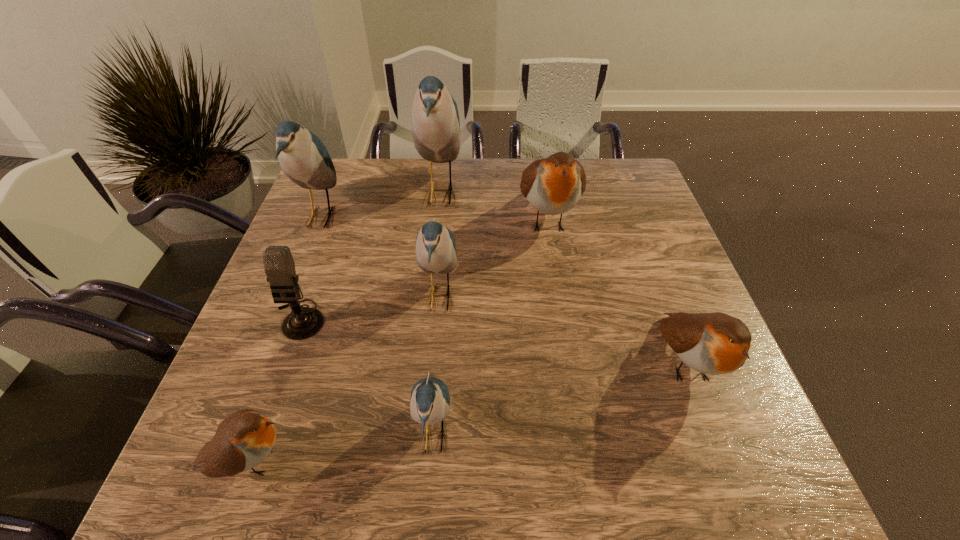
The image size is (960, 540). Identify the location of the nearest blue bird. (430, 401).

Locate an element on the screen. the shortest bird is located at coordinates tap(244, 439).

Identify the location of the shortest object. The width and height of the screenshot is (960, 540). (244, 439).

This screenshot has height=540, width=960. Find the location of `vacant space located at the tip of the tallest object's beak`. vacant space located at the tip of the tallest object's beak is located at coordinates (582, 193).

Where is `vacant space located 0.330m at the tip of the leftmost blue bird's beak`? The height and width of the screenshot is (540, 960). vacant space located 0.330m at the tip of the leftmost blue bird's beak is located at coordinates (456, 217).

Find the location of a particular element. vacant region located at the face of the second bird from right to left is located at coordinates (561, 299).

Identify the location of vacant space located 0.140m at the tip of the third farthest blue bird's beak. (517, 298).

Where is `free region located 0.170m on the front-facing side of the microphone`? The height and width of the screenshot is (540, 960). free region located 0.170m on the front-facing side of the microphone is located at coordinates (265, 414).

Where is `vacant space located 0.070m at the face of the rightmost brown bird`? Image resolution: width=960 pixels, height=540 pixels. vacant space located 0.070m at the face of the rightmost brown bird is located at coordinates (721, 454).

You are a GUI agent. You are given a task and a screenshot of the screen. Output one action in this format:
    pyautogui.click(x=<x>, y=<y>)
    Task: Click on the free space located 0.200m at the tip of the smallest blue bird's beak
    The image size is (960, 540).
    Given the screenshot: What is the action you would take?
    (x=562, y=435)